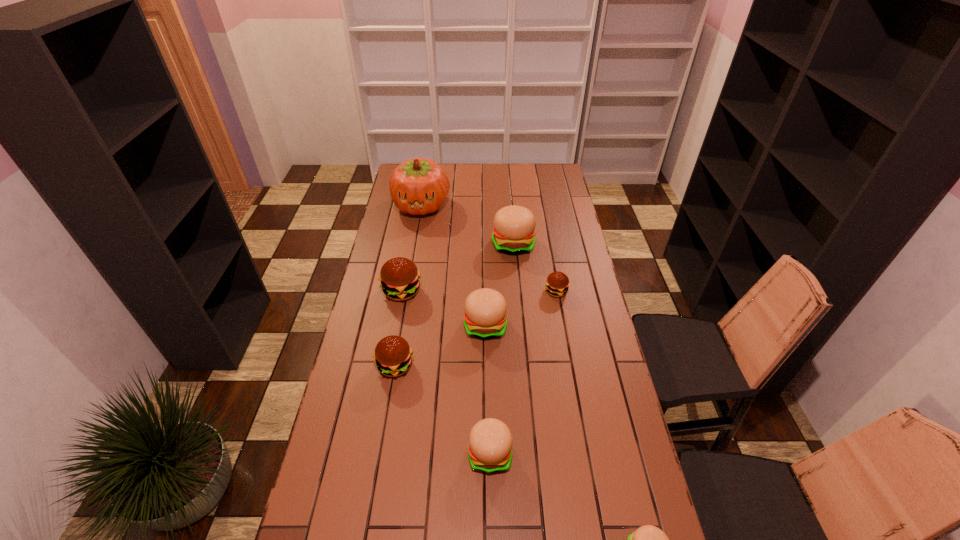
Identify the location of pumpkin that is at the left edge. The width and height of the screenshot is (960, 540). (418, 186).

Locate an element on the screen. object at the right edge is located at coordinates (557, 283).

At what (x,y) coordinates should I click in order to perform the action: click on vacant space at the far edge. Please return your answer as a coordinate pair (x, y). The image size is (960, 540). Looking at the image, I should click on (473, 181).

This screenshot has height=540, width=960. I want to click on vacant space at the left edge of the desktop, so click(x=339, y=395).

In the image, there is a desktop. Where is `free space at the right edge`? Image resolution: width=960 pixels, height=540 pixels. free space at the right edge is located at coordinates (600, 497).

In the image, there is a desktop. Identify the location of free space at the far right corner. Image resolution: width=960 pixels, height=540 pixels. (533, 164).

Find the location of a particular element. The height and width of the screenshot is (540, 960). free spot between the green pumpkin and the smallest brown hamburger is located at coordinates (489, 248).

Locate an element on the screen. empty space that is in between the third nearest beige hamburger and the second nearest object is located at coordinates (488, 389).

Where is `free spot between the biggest beige hamburger and the nearest brown hamburger`? This screenshot has width=960, height=540. free spot between the biggest beige hamburger and the nearest brown hamburger is located at coordinates (454, 305).

Locate an element on the screen. object that can be found as the fifth closest to the second smallest beige hamburger is located at coordinates (557, 283).